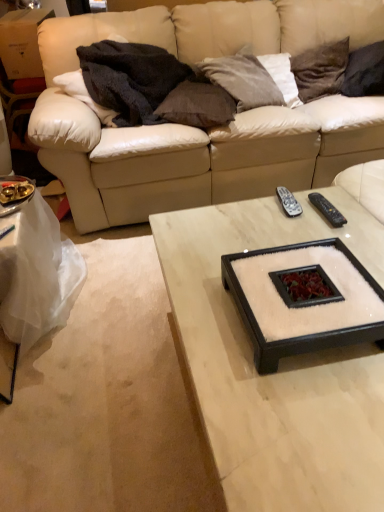
You are a GUI agent. You are given a task and a screenshot of the screen. Output one action in this format:
    pyautogui.click(x=<x>, y=<y>)
    Task: Click on the free space in front of white marble coffee table at lower left, which ranks as the second coffee table in right-to-left order
    
    Given the screenshot: What is the action you would take?
    pyautogui.click(x=77, y=416)